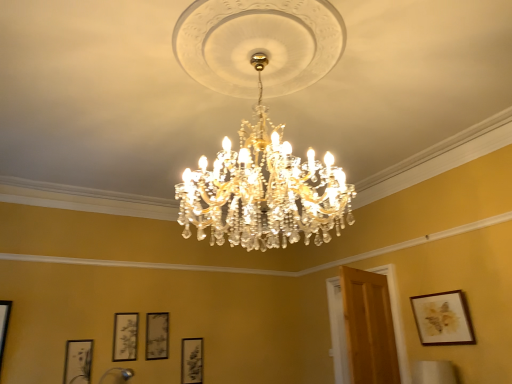
Question: Should I look upward or downward to see matte black picture frame at lower center, the fourth picture frame when ordered from front to back?

Choices:
 (A) up
 (B) down

Answer: (B)

Question: Is matte black picture frame at lower center, the fourth picture frame positioned from the right, bigger than wooden framed artwork at upper right, the first picture frame positioned from the front?

Choices:
 (A) yes
 (B) no

Answer: (B)

Question: Are matte black picture frame at lower center, the third picture frame when ordered from back to front, and wooden framed artwork at upper right, which ranks as the 5th picture frame in back-to-front order, located far from each other?

Choices:
 (A) no
 (B) yes

Answer: (B)

Question: Is matte black picture frame at lower center, which ranks as the third picture frame in front-to-back order, in contact with wooden framed artwork at upper right, the first picture frame positioned from the front?

Choices:
 (A) no
 (B) yes

Answer: (A)

Question: Considering the relative positions of matte black picture frame at lower center, arranged as the second picture frame when viewed from the left, and wooden framed artwork at upper right, which ranks as the 5th picture frame in back-to-front order, in the image provided, is matte black picture frame at lower center, arranged as the second picture frame when viewed from the left, in front of wooden framed artwork at upper right, which ranks as the 5th picture frame in back-to-front order,?

Choices:
 (A) yes
 (B) no

Answer: (B)

Question: Is wooden framed artwork at upper right, marked as the 1th picture frame in a right-to-left arrangement, inside matte black picture frame at lower center, arranged as the second picture frame when viewed from the left?

Choices:
 (A) no
 (B) yes

Answer: (A)

Question: Can you confirm if matte black picture frame at lower center, which ranks as the third picture frame in front-to-back order, is wider than wooden framed artwork at upper right, marked as the 1th picture frame in a right-to-left arrangement?

Choices:
 (A) no
 (B) yes

Answer: (A)

Question: Considering the relative sizes of clear crystal chandelier at center, which is the 1th lamp in right-to-left order, and matte black picture frame at lower center, the 2th picture frame viewed from the back, in the image provided, is clear crystal chandelier at center, which is the 1th lamp in right-to-left order, smaller than matte black picture frame at lower center, the 2th picture frame viewed from the back,?

Choices:
 (A) no
 (B) yes

Answer: (A)

Question: Can you see clear crystal chandelier at center, which is the 1th lamp in right-to-left order, touching matte black picture frame at lower center, the 2th picture frame viewed from the back?

Choices:
 (A) yes
 (B) no

Answer: (B)

Question: Considering the relative sizes of clear crystal chandelier at center, which is the 2th lamp from left to right, and matte black picture frame at lower center, which appears as the 3th picture frame when viewed from the left, in the image provided, is clear crystal chandelier at center, which is the 2th lamp from left to right, thinner than matte black picture frame at lower center, which appears as the 3th picture frame when viewed from the left,?

Choices:
 (A) yes
 (B) no

Answer: (B)

Question: Is clear crystal chandelier at center, positioned as the second lamp in bottom-to-top order, at the right side of matte black picture frame at lower center, which appears as the 3th picture frame when viewed from the left?

Choices:
 (A) yes
 (B) no

Answer: (A)

Question: From a real-world perspective, is clear crystal chandelier at center, which is the 2th lamp from left to right, under matte black picture frame at lower center, the 2th picture frame viewed from the back?

Choices:
 (A) yes
 (B) no

Answer: (B)

Question: Is matte black picture frame at lower center, positioned as the third picture frame in right-to-left order, at the back of clear crystal chandelier at center, which is the 2th lamp from left to right?

Choices:
 (A) no
 (B) yes

Answer: (A)

Question: Considering the relative sizes of wooden framed artwork at upper right, marked as the 1th picture frame in a right-to-left arrangement, and matte black picture frame at lower left, which is the 2th picture frame from front to back, in the image provided, is wooden framed artwork at upper right, marked as the 1th picture frame in a right-to-left arrangement, bigger than matte black picture frame at lower left, which is the 2th picture frame from front to back,?

Choices:
 (A) yes
 (B) no

Answer: (A)